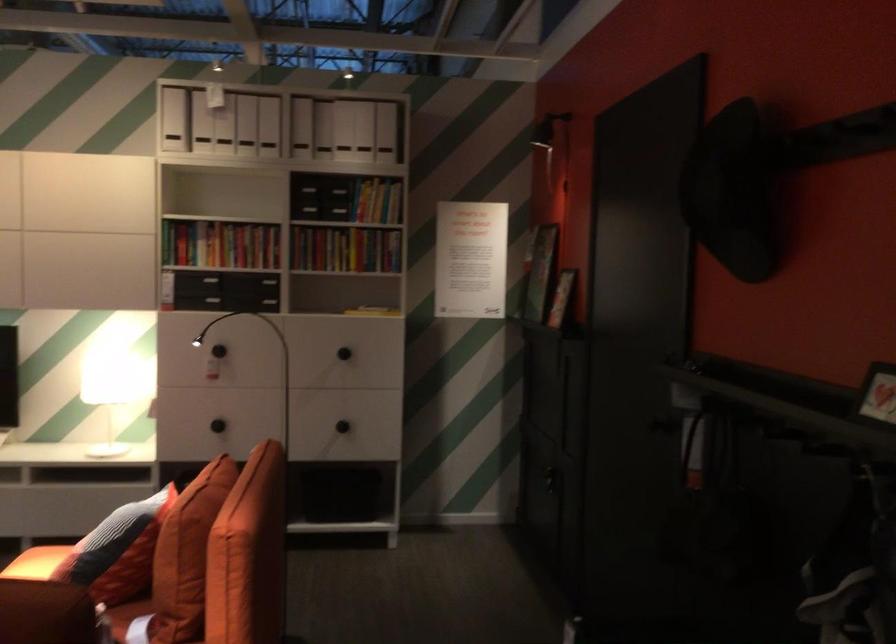
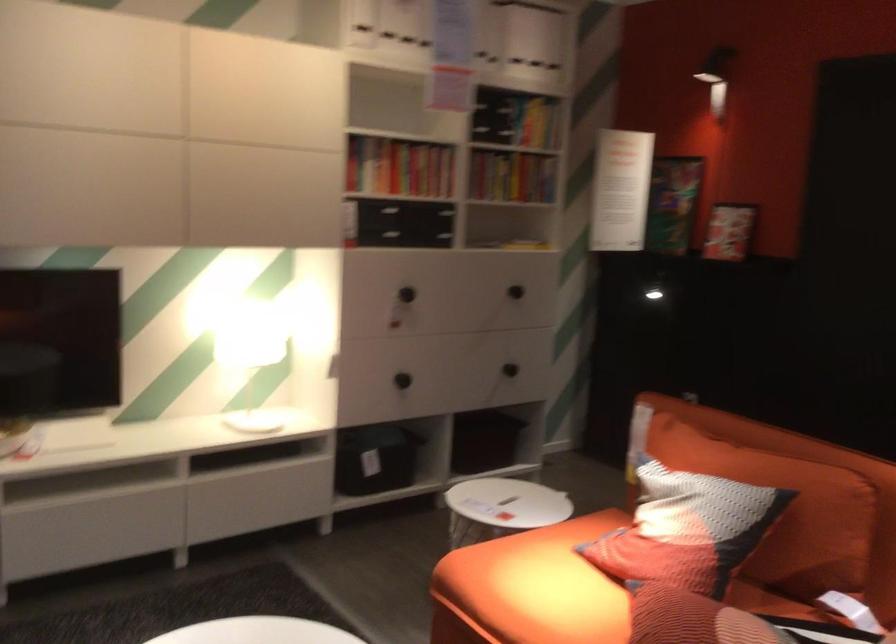
Question: I am providing you with two images of the same scene from different viewpoints. After the viewpoint changes to image2, which objects are now occluded?

Choices:
 (A) patterned throw pillow
 (B) white table lamp
 (C) sofa sitting surface
 (D) none of these

Answer: (D)